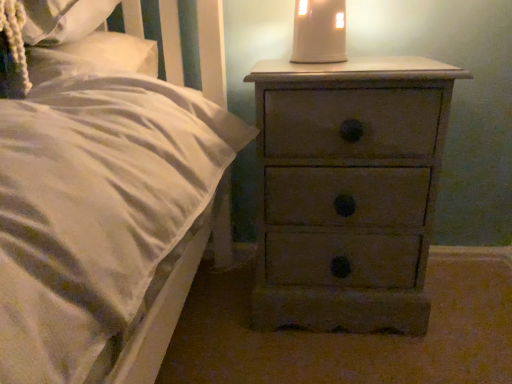
I want to click on vacant space positioned to the left of distressed wood chest of drawers at right, so click(216, 322).